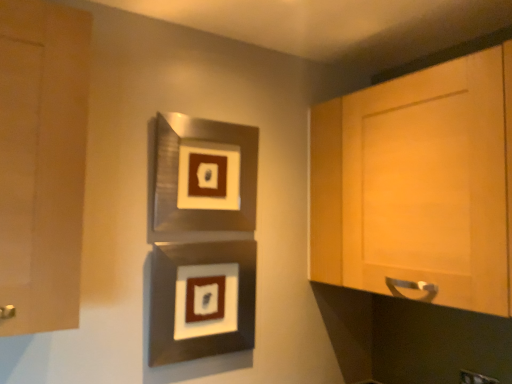
Question: Are metallic silver picture frame at center, the first picture frame positioned from the bottom, and matte wood cabinet at left, which is the 1th cabinetry from left to right, located far from each other?

Choices:
 (A) no
 (B) yes

Answer: (A)

Question: Considering the relative positions of metallic silver picture frame at center, positioned as the 2th picture frame in top-to-bottom order, and matte wood cabinet at left, which is the 1th cabinetry from left to right, in the image provided, is metallic silver picture frame at center, positioned as the 2th picture frame in top-to-bottom order, to the right of matte wood cabinet at left, which is the 1th cabinetry from left to right, from the viewer's perspective?

Choices:
 (A) no
 (B) yes

Answer: (B)

Question: From a real-world perspective, is metallic silver picture frame at center, positioned as the 2th picture frame in top-to-bottom order, located higher than matte wood cabinet at left, the second cabinetry positioned from the right?

Choices:
 (A) yes
 (B) no

Answer: (B)

Question: Is metallic silver picture frame at center, positioned as the 2th picture frame in top-to-bottom order, further to the viewer compared to matte wood cabinet at left, which is the 1th cabinetry from left to right?

Choices:
 (A) yes
 (B) no

Answer: (A)

Question: Considering the relative sizes of metallic silver picture frame at center, positioned as the 2th picture frame in top-to-bottom order, and matte wood cabinet at left, which is the 1th cabinetry from left to right, in the image provided, is metallic silver picture frame at center, positioned as the 2th picture frame in top-to-bottom order, bigger than matte wood cabinet at left, which is the 1th cabinetry from left to right,?

Choices:
 (A) no
 (B) yes

Answer: (A)

Question: In the image, is metallic silver picture frame at center, positioned as the 2th picture frame in top-to-bottom order, on the left side or the right side of light wood cabinet at right, which ranks as the second cabinetry in left-to-right order?

Choices:
 (A) right
 (B) left

Answer: (B)

Question: Considering the positions of metallic silver picture frame at center, positioned as the 2th picture frame in top-to-bottom order, and light wood cabinet at right, which ranks as the second cabinetry in left-to-right order, in the image, is metallic silver picture frame at center, positioned as the 2th picture frame in top-to-bottom order, wider or thinner than light wood cabinet at right, which ranks as the second cabinetry in left-to-right order,?

Choices:
 (A) thin
 (B) wide

Answer: (A)

Question: Considering their positions, is metallic silver picture frame at center, the first picture frame positioned from the bottom, located in front of or behind light wood cabinet at right, which ranks as the second cabinetry in left-to-right order?

Choices:
 (A) behind
 (B) front

Answer: (A)

Question: Is metallic silver picture frame at center, the first picture frame positioned from the bottom, situated inside light wood cabinet at right, the 1th cabinetry in the right-to-left sequence, or outside?

Choices:
 (A) outside
 (B) inside

Answer: (A)

Question: From the image's perspective, relative to metallic silver picture frame at center, which ranks as the first picture frame in top-to-bottom order, is light wood cabinet at right, which ranks as the second cabinetry in left-to-right order, above or below?

Choices:
 (A) below
 (B) above

Answer: (A)

Question: From a real-world perspective, relative to metallic silver picture frame at center, which ranks as the first picture frame in top-to-bottom order, is light wood cabinet at right, which ranks as the second cabinetry in left-to-right order, vertically above or below?

Choices:
 (A) above
 (B) below

Answer: (B)

Question: Looking at their shapes, would you say light wood cabinet at right, which ranks as the second cabinetry in left-to-right order, is wider or thinner than metallic silver picture frame at center, which ranks as the first picture frame in top-to-bottom order?

Choices:
 (A) thin
 (B) wide

Answer: (B)

Question: Considering the relative positions of light wood cabinet at right, the 1th cabinetry in the right-to-left sequence, and metallic silver picture frame at center, which ranks as the second picture frame in bottom-to-top order, in the image provided, is light wood cabinet at right, the 1th cabinetry in the right-to-left sequence, to the left or to the right of metallic silver picture frame at center, which ranks as the second picture frame in bottom-to-top order,?

Choices:
 (A) right
 (B) left

Answer: (A)

Question: Is point (390, 226) positioned closer to the camera than point (12, 233)?

Choices:
 (A) farther
 (B) closer

Answer: (A)

Question: Based on their positions, is light wood cabinet at right, which ranks as the second cabinetry in left-to-right order, located to the left or right of matte wood cabinet at left, which is the 1th cabinetry from left to right?

Choices:
 (A) left
 (B) right

Answer: (B)